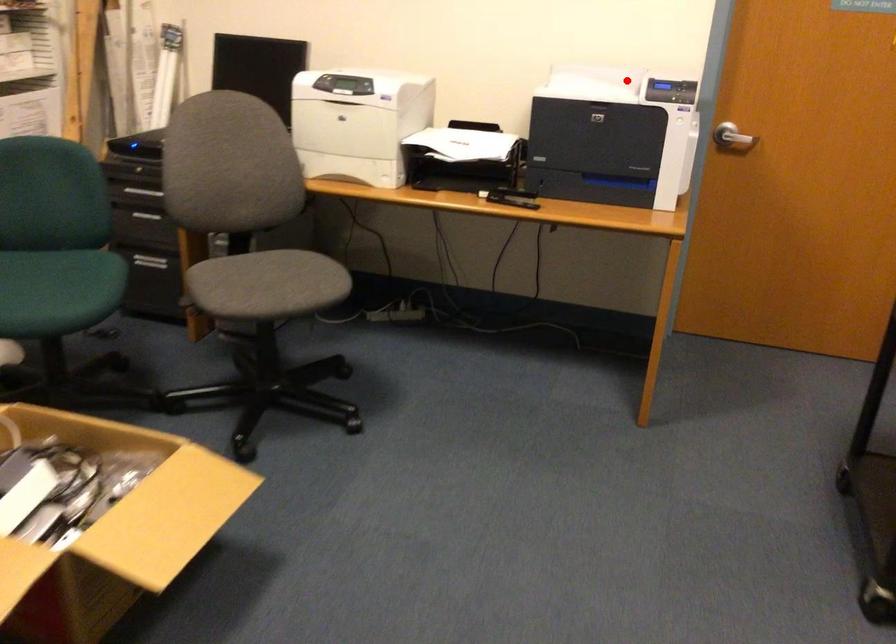
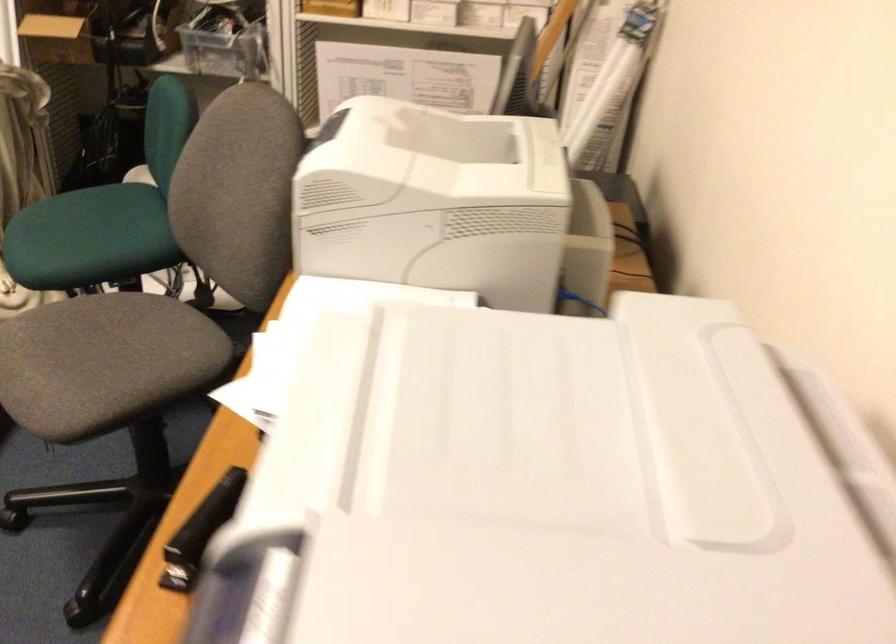
In the second image, find the point that corresponds to the highlighted location in the first image.

(593, 491)